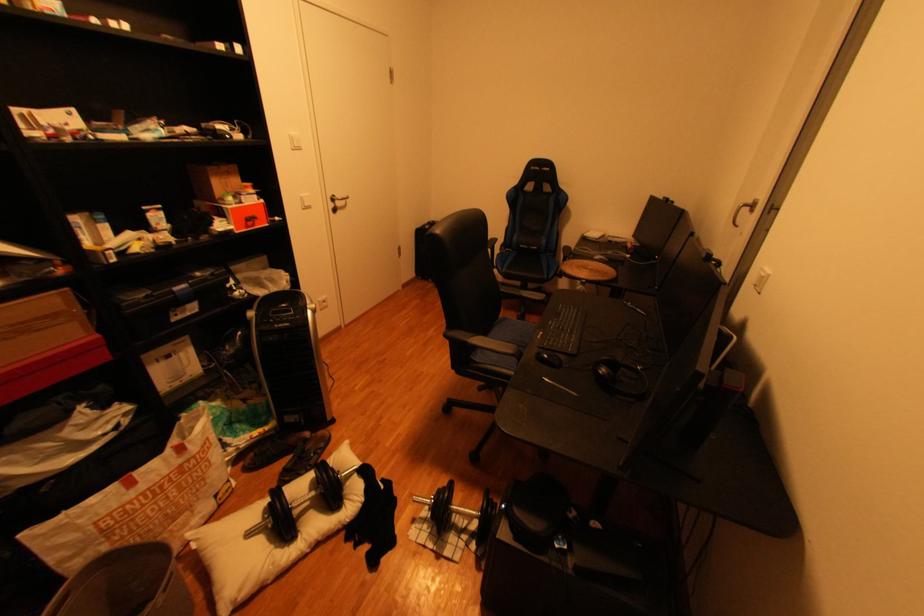
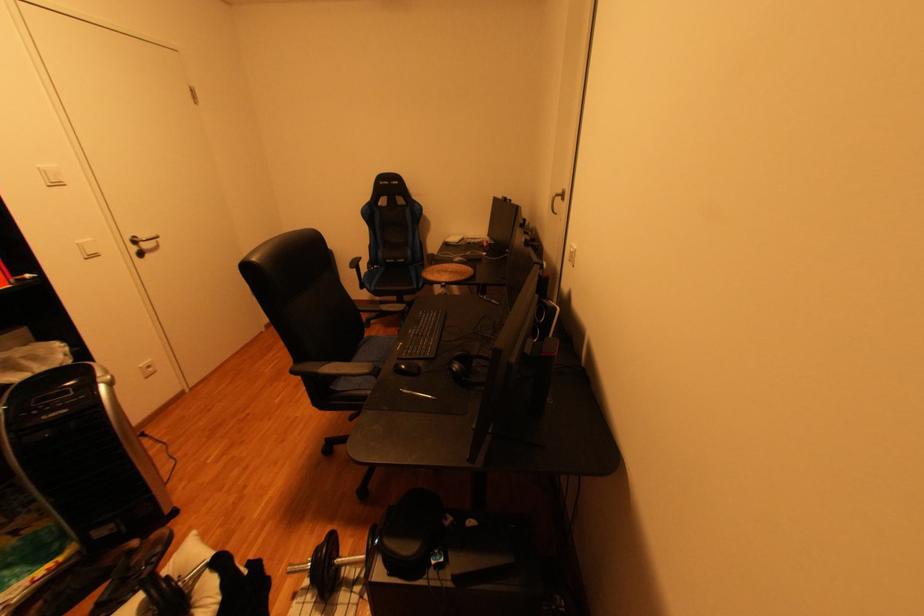
Locate, in the second image, the point that corresponds to point (520, 251) in the first image.

(390, 267)